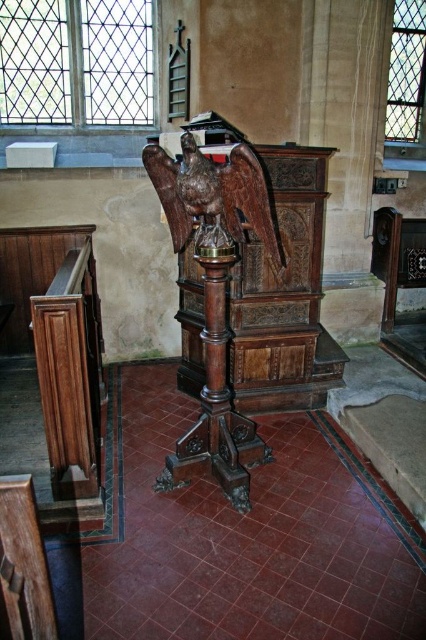
Question: Can you confirm if polished wood eagle at center is thinner than wooden chair at lower left?

Choices:
 (A) yes
 (B) no

Answer: (B)

Question: Can you confirm if polished wood eagle at center is smaller than wooden chair at lower left?

Choices:
 (A) no
 (B) yes

Answer: (A)

Question: Which point is farther from the camera taking this photo?

Choices:
 (A) (3, 528)
 (B) (233, 176)

Answer: (B)

Question: Which point is closer to the camera?

Choices:
 (A) (241, 186)
 (B) (28, 637)

Answer: (B)

Question: Can you confirm if polished wood eagle at center is wider than wooden chair at lower left?

Choices:
 (A) yes
 (B) no

Answer: (A)